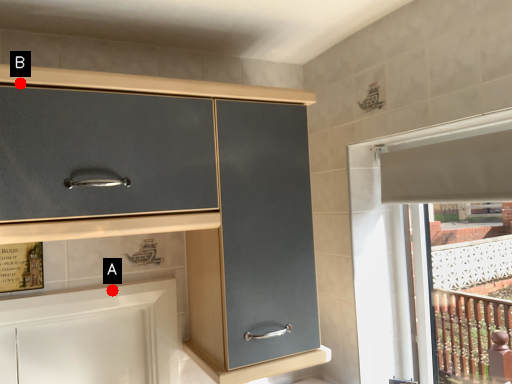
Question: Two points are circled on the image, labeled by A and B beside each circle. Which point appears farthest from the camera in this image?

Choices:
 (A) A is further
 (B) B is further

Answer: (A)